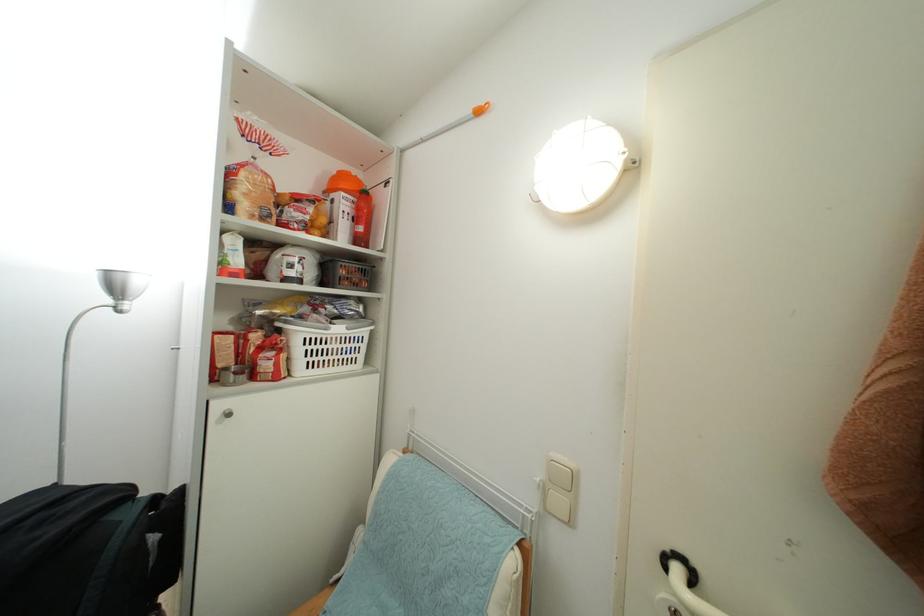
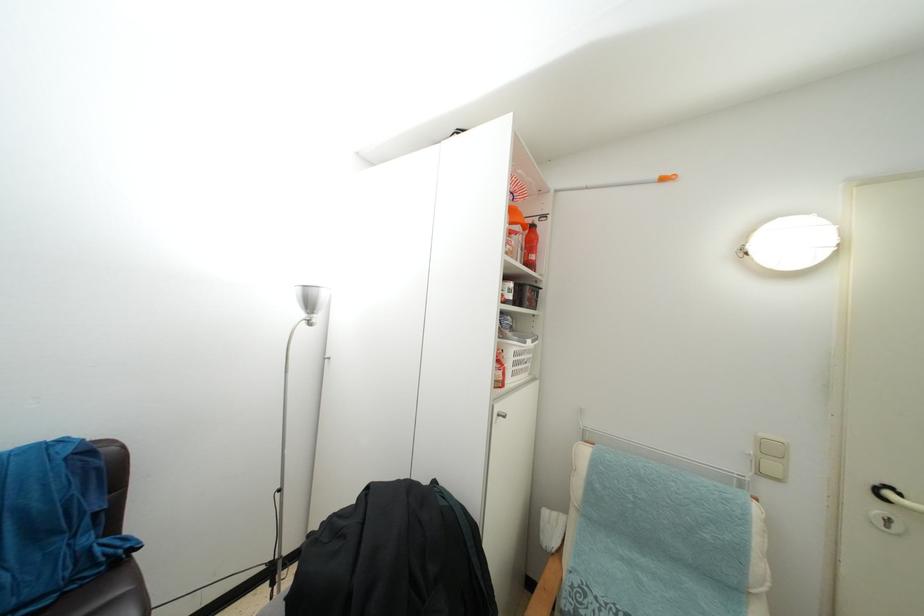
Question: The camera is either moving clockwise (left) or counter-clockwise (right) around the object. The first image is from the beginning of the video and the second image is from the end. Is the camera moving left or right when shooting the video?

Choices:
 (A) Left
 (B) Right

Answer: (A)